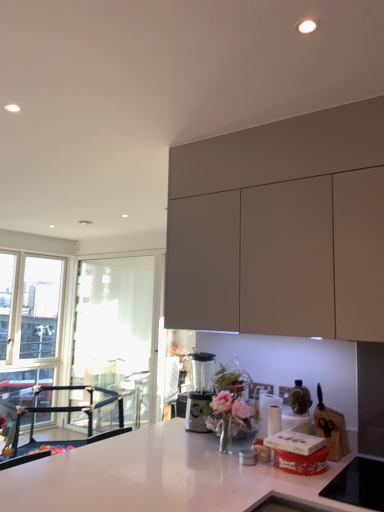
You are a GUI agent. You are given a task and a screenshot of the screen. Output one action in this format:
    pyautogui.click(x=<x>, y=<y>)
    Task: Click on the vacant space to the left of sleek metallic blender at center
    The image size is (384, 512).
    Given the screenshot: What is the action you would take?
    pyautogui.click(x=165, y=425)